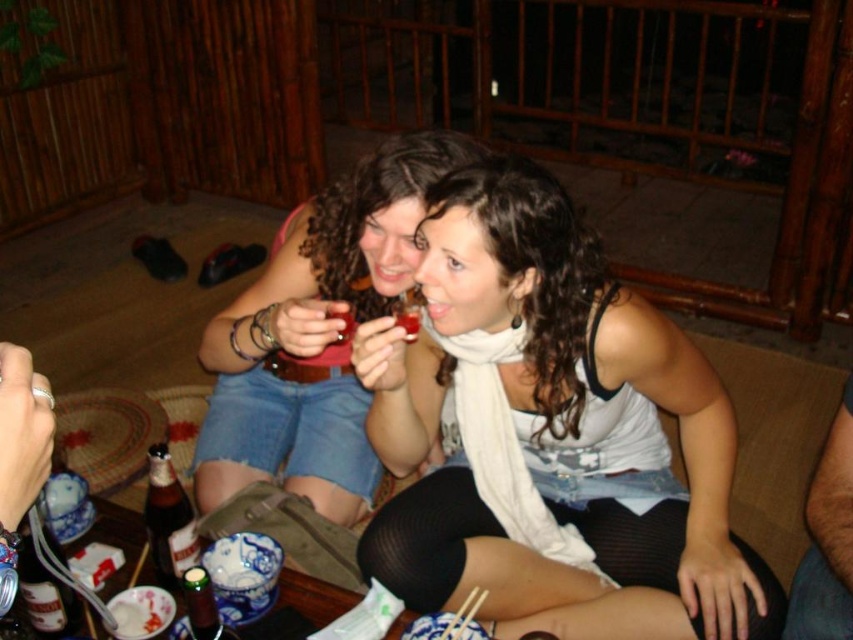
Question: Can you confirm if white matte scarf at center is thinner than dark blue jeans at lower right?

Choices:
 (A) yes
 (B) no

Answer: (B)

Question: Does white scarf at center appear on the left side of translucent glass cup at center?

Choices:
 (A) yes
 (B) no

Answer: (A)

Question: Considering the real-world distances, which object is closest to the dark blue jeans at lower right?

Choices:
 (A) matte plastic cup at center
 (B) brown glass bottle at lower left
 (C) white scarf at center

Answer: (A)

Question: Is green matte bottle at lower left further to the viewer compared to matte plastic cup at center?

Choices:
 (A) yes
 (B) no

Answer: (B)

Question: Estimate the real-world distances between objects in this image. Which object is closer to the brown glass bottle at lower left?

Choices:
 (A) white scarf at center
 (B) translucent glass cup at center

Answer: (A)

Question: Which is farther from the dark blue jeans at lower right?

Choices:
 (A) white scarf at center
 (B) matte plastic cup at center

Answer: (A)